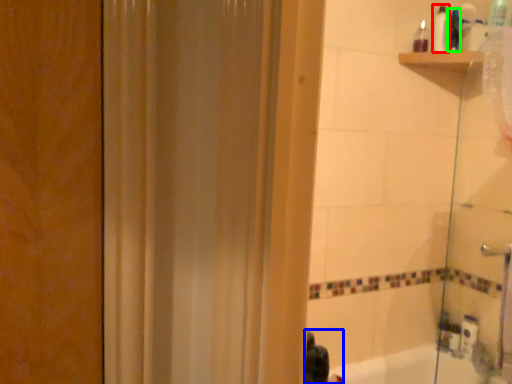
Question: Based on their relative distances, which object is farther from toiletry (highlighted by a red box)? Choose from person (highlighted by a blue box) and toiletry (highlighted by a green box).

Choices:
 (A) person
 (B) toiletry

Answer: (A)